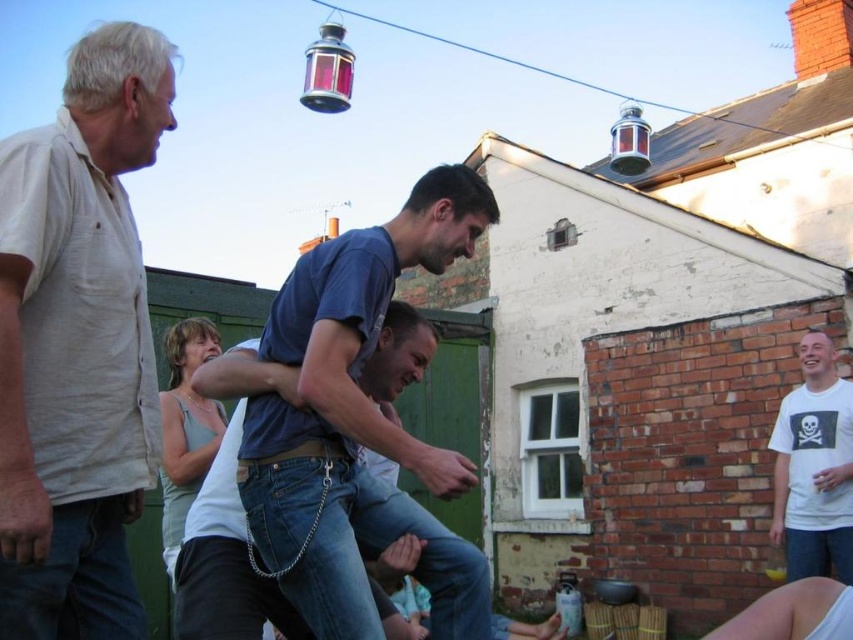
You are standing at the edge of the scene and want to hand a drink to the person wearing the light beige cotton shirt at left. Considering the distance, can you reach them without moving closer?

The light beige cotton shirt at left is 20.61 meters from the viewer, which is too far to reach without moving closer. You need to approach them to hand the drink.